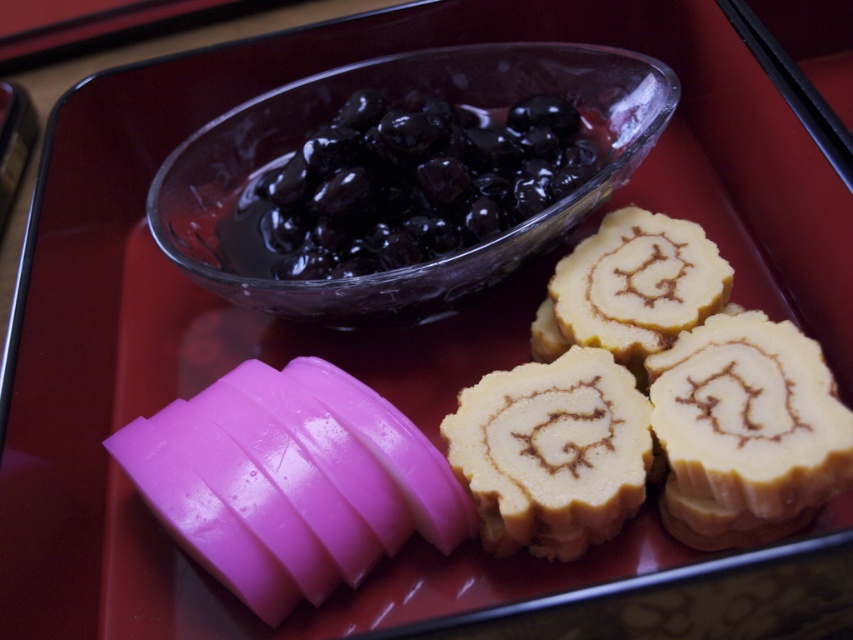
Can you confirm if yellow sponge cake at right is bigger than swirled caramel cake at center?

Indeed, yellow sponge cake at right has a larger size compared to swirled caramel cake at center.

Consider the image. Between yellow sponge cake at right and swirled caramel cake at center, which one is positioned higher?

yellow sponge cake at right

The height and width of the screenshot is (640, 853). Find the location of `yellow sponge cake at right`. yellow sponge cake at right is located at coordinates (650, 404).

Find the location of a particular element. Image resolution: width=853 pixels, height=640 pixels. yellow sponge cake at right is located at coordinates (650, 404).

Who is shorter, transparent glass bowl at upper center or swirled caramel cake at center?

swirled caramel cake at center

Does point (619, 51) come in front of point (503, 396)?

No, it is not.

Where is `transparent glass bowl at upper center`? transparent glass bowl at upper center is located at coordinates (399, 108).

Measure the distance from glossy dark blue grapes at upper center to swirled caramel cake at center.

glossy dark blue grapes at upper center is 11.40 inches away from swirled caramel cake at center.

Is point (448, 211) less distant than point (572, 493)?

No, it is not.

Between point (450, 145) and point (532, 444), which one is positioned in front?

Point (532, 444)

At what (x,y) coordinates should I click in order to perform the action: click on glossy dark blue grapes at upper center. Please return your answer as a coordinate pair (x, y). Looking at the image, I should click on (415, 182).